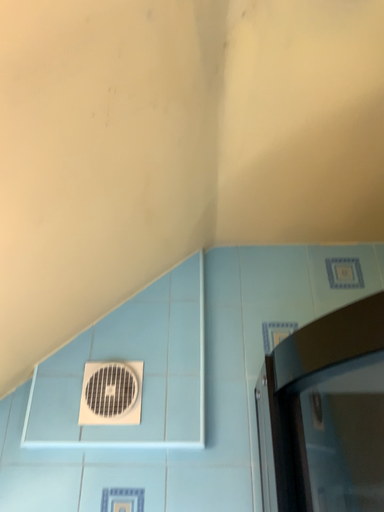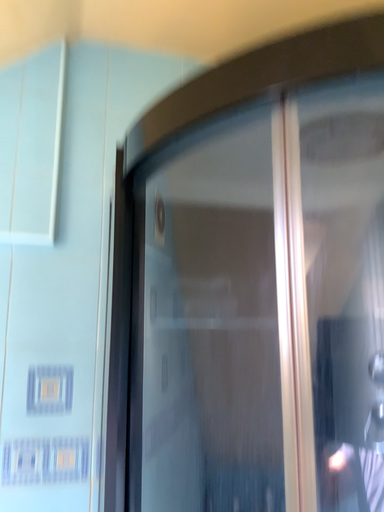
Question: Which way did the camera rotate in the video?

Choices:
 (A) rotated upward
 (B) rotated downward

Answer: (B)